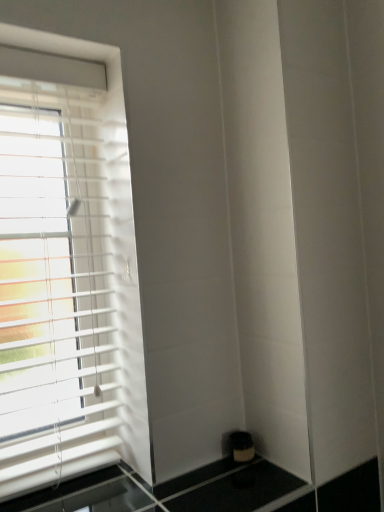
Find the location of `white plastic blinds at left`. white plastic blinds at left is located at coordinates pyautogui.click(x=54, y=273).

The height and width of the screenshot is (512, 384). Describe the element at coordinates (54, 273) in the screenshot. I see `white plastic blinds at left` at that location.

At what (x,y) coordinates should I click in order to perform the action: click on white plastic blinds at left. Please return your answer as a coordinate pair (x, y). This screenshot has width=384, height=512. Looking at the image, I should click on (54, 273).